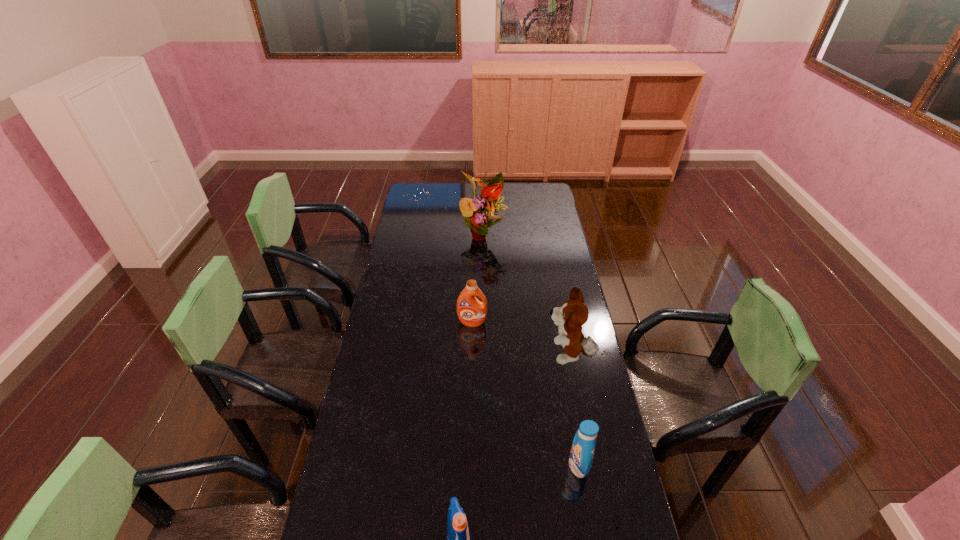
Find the location of a particular element. This screenshot has width=960, height=540. vacant area that lies between the farthest object and the farthest detergent is located at coordinates pyautogui.click(x=478, y=278).

Locate which object is the second closest to the puppy. Please provide its 2D coordinates. Your answer should be formatted as a tuple, i.e. [(x, y)], where the tuple contains the x and y coordinates of a point satisfying the conditions above.

[(582, 451)]

This screenshot has width=960, height=540. Find the location of `object that can be found as the second closest to the puppy`. object that can be found as the second closest to the puppy is located at coordinates (582, 451).

Where is `detergent that is the second closest to the nearest object`? detergent that is the second closest to the nearest object is located at coordinates click(x=471, y=312).

Identify which detergent is the second nearest to the farthest detergent. Please provide its 2D coordinates. Your answer should be formatted as a tuple, i.e. [(x, y)], where the tuple contains the x and y coordinates of a point satisfying the conditions above.

[(458, 535)]